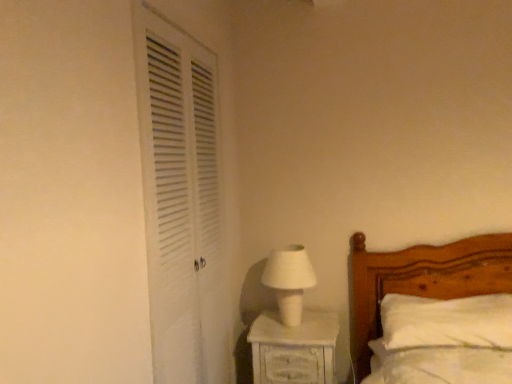
This screenshot has height=384, width=512. I want to click on white painted wood nightstand at lower right, so click(294, 349).

The image size is (512, 384). I want to click on white louvered door at left, so click(181, 201).

What do you see at coordinates (289, 280) in the screenshot? I see `white matte table lamp at center` at bounding box center [289, 280].

At what (x,y) coordinates should I click in order to perform the action: click on white painted wood nightstand at lower right. Please return your answer as a coordinate pair (x, y). Looking at the image, I should click on (294, 349).

Find the location of a particular element. This screenshot has height=384, width=512. table lamp behind the white louvered door at left is located at coordinates (289, 280).

Between white matte table lamp at center and white louvered door at left, which one has smaller width?

white louvered door at left.

Which object is more forward, white matte table lamp at center or white louvered door at left?

Positioned in front is white louvered door at left.

Are white matte table lamp at center and white louvered door at left located far from each other?

No, white matte table lamp at center is in close proximity to white louvered door at left.

From a real-world perspective, is white painted wood nightstand at lower right located beneath white louvered door at left?

Indeed, from a real-world perspective, white painted wood nightstand at lower right is positioned beneath white louvered door at left.

Considering the sizes of white painted wood nightstand at lower right and white louvered door at left in the image, is white painted wood nightstand at lower right wider or thinner than white louvered door at left?

white painted wood nightstand at lower right is wider than white louvered door at left.

Is white painted wood nightstand at lower right touching white louvered door at left?

No, white painted wood nightstand at lower right is not in contact with white louvered door at left.

Locate an element on the screen. screen door in front of the white painted wood nightstand at lower right is located at coordinates (181, 201).

Is white painted wood nightstand at lower right in front of or behind white matte table lamp at center in the image?

Clearly, white painted wood nightstand at lower right is in front of white matte table lamp at center.

Where is `nightstand located below the white matte table lamp at center (from the image's perspective)`? This screenshot has height=384, width=512. nightstand located below the white matte table lamp at center (from the image's perspective) is located at coordinates (294, 349).

Is white painted wood nightstand at lower right in contact with white matte table lamp at center?

No.

Consider the image. Is white louvered door at left facing away from white soft pillow at lower right?

No, white louvered door at left's orientation is not away from white soft pillow at lower right.

Looking at their sizes, would you say white louvered door at left is wider or thinner than white soft pillow at lower right?

white louvered door at left is thinner than white soft pillow at lower right.

Which is in front, point (206, 49) or point (431, 332)?

Point (431, 332)

Is white louvered door at left in front of white soft pillow at lower right?

Yes.

Who is smaller, white louvered door at left or white matte table lamp at center?

Smaller between the two is white matte table lamp at center.

Is white louvered door at left facing away from white matte table lamp at center?

No, white louvered door at left is not facing the opposite direction of white matte table lamp at center.

Is white louvered door at left to the left of white matte table lamp at center from the viewer's perspective?

Yes.

What's the angular difference between white louvered door at left and white matte table lamp at center's facing directions?

The facing directions of white louvered door at left and white matte table lamp at center are 82.6 degrees apart.

Considering the relative sizes of white soft pillow at lower right and white matte table lamp at center in the image provided, is white soft pillow at lower right taller than white matte table lamp at center?

No.

In the scene shown: From the image's perspective, would you say white soft pillow at lower right is shown under white matte table lamp at center?

Indeed, from the image's perspective, white soft pillow at lower right is shown beneath white matte table lamp at center.

Is point (442, 304) closer to viewer compared to point (286, 318)?

Yes.

From the image's perspective, is white matte table lamp at center over white painted wood nightstand at lower right?

Yes, from the image's perspective, white matte table lamp at center is on top of white painted wood nightstand at lower right.

Is white matte table lamp at center closer to the viewer compared to white painted wood nightstand at lower right?

No, white matte table lamp at center is further to the viewer.

Consider the image. Does white matte table lamp at center have a smaller size compared to white painted wood nightstand at lower right?

Yes, white matte table lamp at center is smaller than white painted wood nightstand at lower right.

Does point (289, 269) come closer to viewer compared to point (320, 352)?

No, (289, 269) is behind (320, 352).

Where is `screen door above the white matte table lamp at center (from a real-world perspective)`? This screenshot has height=384, width=512. screen door above the white matte table lamp at center (from a real-world perspective) is located at coordinates (181, 201).

The width and height of the screenshot is (512, 384). Find the location of `nightstand that is under the white louvered door at left (from a real-world perspective)`. nightstand that is under the white louvered door at left (from a real-world perspective) is located at coordinates (294, 349).

Which object lies further to the anchor point white matte table lamp at center, white soft pillow at lower right or white painted wood nightstand at lower right?

Among the two, white soft pillow at lower right is located further to white matte table lamp at center.

Based on their spatial positions, is white louvered door at left or white matte table lamp at center further from white painted wood nightstand at lower right?

white louvered door at left is positioned further to the anchor white painted wood nightstand at lower right.

Estimate the real-world distances between objects in this image. Which object is closer to white painted wood nightstand at lower right, white matte table lamp at center or white louvered door at left?

white matte table lamp at center is positioned closer to the anchor white painted wood nightstand at lower right.

In the scene shown: From the image, which object appears to be farther from white louvered door at left, white matte table lamp at center or white painted wood nightstand at lower right?

white painted wood nightstand at lower right is positioned further to the anchor white louvered door at left.

Which object lies nearer to the anchor point white matte table lamp at center, white louvered door at left or white painted wood nightstand at lower right?

Among the two, white painted wood nightstand at lower right is located nearer to white matte table lamp at center.

From the picture: When comparing their distances from white painted wood nightstand at lower right, does white louvered door at left or white soft pillow at lower right seem further?

Among the two, white louvered door at left is located further to white painted wood nightstand at lower right.

From the image, which object appears to be nearer to white soft pillow at lower right, white painted wood nightstand at lower right or white matte table lamp at center?

Based on the image, white painted wood nightstand at lower right appears to be nearer to white soft pillow at lower right.

From the image, which object appears to be nearer to white matte table lamp at center, white painted wood nightstand at lower right or white louvered door at left?

white painted wood nightstand at lower right.

I want to click on nightstand situated between white louvered door at left and white soft pillow at lower right from left to right, so click(294, 349).

The width and height of the screenshot is (512, 384). What are the coordinates of `nightstand between white matte table lamp at center and white soft pillow at lower right from left to right` in the screenshot? It's located at pos(294,349).

What are the coordinates of `nightstand positioned between white louvered door at left and white matte table lamp at center from near to far` in the screenshot? It's located at (294, 349).

This screenshot has width=512, height=384. I want to click on table lamp between white louvered door at left and white soft pillow at lower right in the horizontal direction, so pos(289,280).